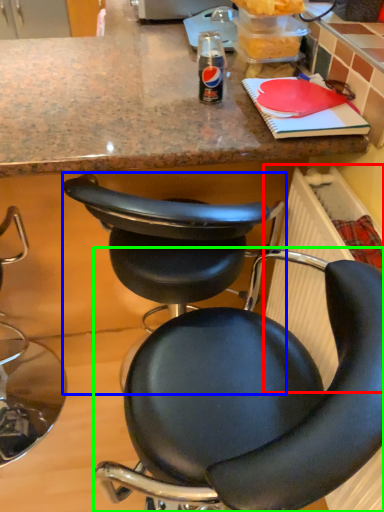
Question: Based on their relative distances, which object is nearer to radiator (highlighted by a red box)? Choose from chair (highlighted by a blue box) and chair (highlighted by a green box).

Choices:
 (A) chair
 (B) chair

Answer: (B)